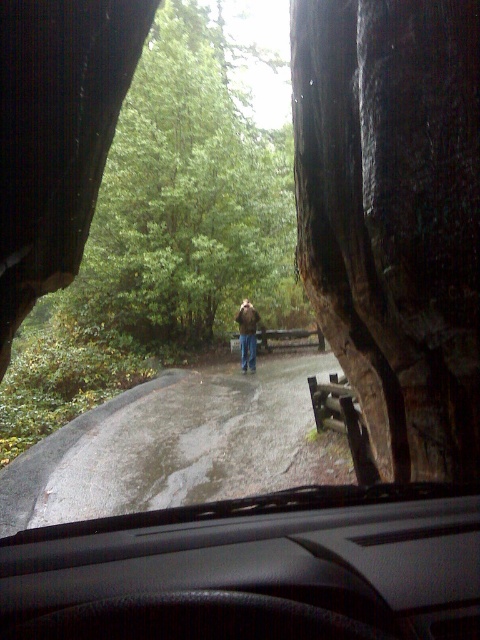
You are driving a car and see the green leafy tree at center ahead. Your car is 5 meters long. If you want to completely pass the tree, how much additional road space do you need in front of your car?

The green leafy tree at center and viewer are 17.00 meters apart from each other. Since the car is 5 meters long, you need an additional 12 meters of road space in front of the car to completely pass the tree.

Consider the image. You are driving through a forest and see a green leafy tree at center and a brown leather jacket at center. If you want to park your car so that both objects are visible from the driver seat, which one should be closer to the car?

The green leafy tree at center is closer to the car than the brown leather jacket at center because the distance between them is 16.95 feet, so the tree would be in front of the jacket and visible through the windshield.

You are driving through a forest and see a green leafy tree at center and a brown leather jacket at center from your car. Which object is higher in your view?

The green leafy tree at center is located above the brown leather jacket at center, so it is higher in your view.